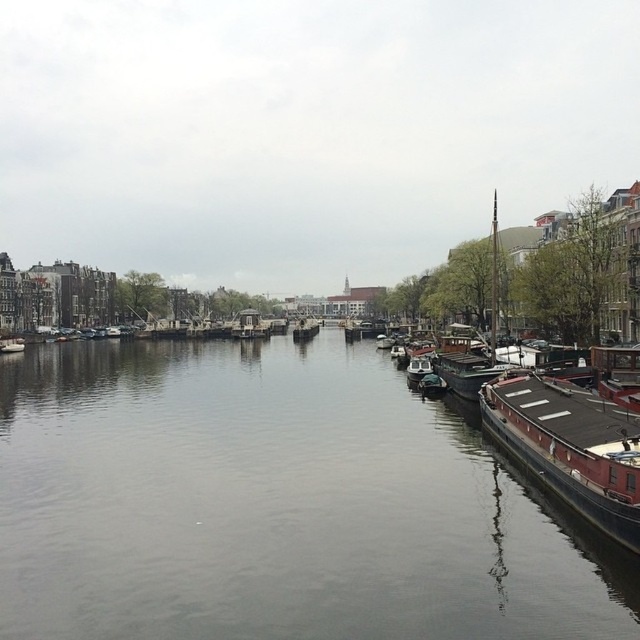
Question: Does smooth water at center come behind brown wooden barge at right?

Choices:
 (A) yes
 (B) no

Answer: (B)

Question: Is smooth water at center positioned in front of brown wooden barge at right?

Choices:
 (A) no
 (B) yes

Answer: (B)

Question: Which of the following is the farthest from the observer?

Choices:
 (A) 28,397
 (B) 552,392

Answer: (A)

Question: Is smooth water at center wider than brown wooden barge at right?

Choices:
 (A) yes
 (B) no

Answer: (A)

Question: Which point is closer to the camera taking this photo?

Choices:
 (A) (612, 500)
 (B) (432, 484)

Answer: (A)